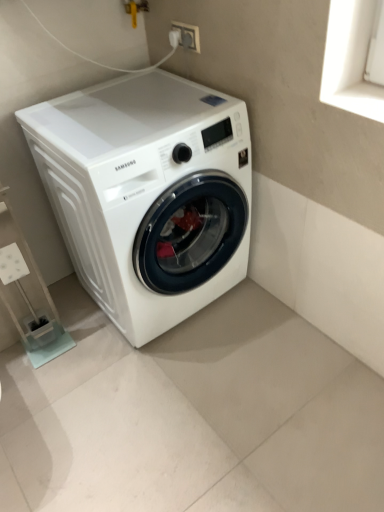
Image resolution: width=384 pixels, height=512 pixels. I want to click on white plastic socket at upper center, so click(x=188, y=34).

You are a GUI agent. You are given a task and a screenshot of the screen. Output one action in this format:
    pyautogui.click(x=<x>, y=<y>)
    Task: Click on the white plastic socket at upper center
    
    Given the screenshot: What is the action you would take?
    pyautogui.click(x=188, y=34)

Is white plastic shelf at lower left turned away from white plastic socket at upper center?

white plastic shelf at lower left does not have its back to white plastic socket at upper center.

Between point (19, 231) and point (195, 32), which one is positioned in front?

The point (195, 32) is in front.

Considering their positions, is white plastic shelf at lower left located in front of or behind white plastic socket at upper center?

In the image, white plastic shelf at lower left appears in front of white plastic socket at upper center.

Considering the relative sizes of white plastic shelf at lower left and white plastic socket at upper center in the image provided, is white plastic shelf at lower left taller than white plastic socket at upper center?

Indeed, white plastic shelf at lower left has a greater height compared to white plastic socket at upper center.

In the scene shown: From the image's perspective, which object appears higher, white plastic socket at upper center or white glossy washing machine at center?

white plastic socket at upper center.

Which point is more distant from viewer, (193,42) or (153,305)?

The point (153,305) is farther from the camera.

From the picture: Considering the positions of objects white plastic socket at upper center and white glossy washing machine at center in the image provided, who is more to the right, white plastic socket at upper center or white glossy washing machine at center?

Positioned to the right is white plastic socket at upper center.

Do you think white plastic socket at upper center is within white glossy washing machine at center, or outside of it?

white plastic socket at upper center lies outside white glossy washing machine at center.

From a real-world perspective, which is physically above, white glossy washing machine at center or white plastic socket at upper center?

white plastic socket at upper center is physically above.

In terms of width, does white glossy washing machine at center look wider or thinner when compared to white plastic socket at upper center?

Clearly, white glossy washing machine at center has more width compared to white plastic socket at upper center.

Considering the points (105, 131) and (181, 41), which point is in front, point (105, 131) or point (181, 41)?

The point (105, 131) is in front.

Considering the positions of objects white glossy washing machine at center and white plastic socket at upper center in the image provided, who is in front, white glossy washing machine at center or white plastic socket at upper center?

white glossy washing machine at center is closer to the camera.

Is white plastic socket at upper center aimed at white plastic shelf at lower left?

No, white plastic socket at upper center is not oriented towards white plastic shelf at lower left.

Is white plastic socket at upper center not inside white plastic shelf at lower left?

white plastic socket at upper center is positioned outside white plastic shelf at lower left.

Are white plastic socket at upper center and white plastic shelf at lower left far apart?

Yes, white plastic socket at upper center is far from white plastic shelf at lower left.

Can you confirm if white plastic socket at upper center is shorter than white plastic shelf at lower left?

Yes.

From the image's perspective, is white plastic shelf at lower left on white glossy washing machine at center?

Actually, white plastic shelf at lower left appears below white glossy washing machine at center in the image.

Considering the points (49, 348) and (199, 123), which point is in front, point (49, 348) or point (199, 123)?

Positioned in front is point (199, 123).

Is white plastic shelf at lower left completely or partially outside of white glossy washing machine at center?

That's correct, white plastic shelf at lower left is outside of white glossy washing machine at center.

Is white plastic shelf at lower left looking in the opposite direction of white glossy washing machine at center?

No.

Image resolution: width=384 pixels, height=512 pixels. Identify the location of washing machine that appears above the white plastic shelf at lower left (from the image's perspective). (144, 191).

How far apart are white glossy washing machine at center and white plastic shelf at lower left?

white glossy washing machine at center is 17.73 inches from white plastic shelf at lower left.

Is white glossy washing machine at center positioned far away from white plastic shelf at lower left?

white glossy washing machine at center is near white plastic shelf at lower left, not far away.

In the image, there is a white plastic shelf at lower left. At what (x,y) coordinates should I click in order to perform the action: click on electric outlet above it (from the image's perspective). Please return your answer as a coordinate pair (x, y). The image size is (384, 512). Looking at the image, I should click on (188, 34).

Find the location of `washing machine on the left of the white plastic socket at upper center`. washing machine on the left of the white plastic socket at upper center is located at coordinates (144, 191).

Considering their positions, is white plastic shelf at lower left positioned further to white plastic socket at upper center than white glossy washing machine at center?

white plastic shelf at lower left is positioned further to the anchor white plastic socket at upper center.

From the image, which object appears to be nearer to white glossy washing machine at center, white plastic shelf at lower left or white plastic socket at upper center?

Based on the image, white plastic shelf at lower left appears to be nearer to white glossy washing machine at center.

Estimate the real-world distances between objects in this image. Which object is further from white glossy washing machine at center, white plastic socket at upper center or white plastic shelf at lower left?

white plastic socket at upper center is further to white glossy washing machine at center.

Considering their positions, is white glossy washing machine at center positioned closer to white plastic socket at upper center than white plastic shelf at lower left?

Among the two, white glossy washing machine at center is located nearer to white plastic socket at upper center.

Which object lies further to the anchor point white plastic shelf at lower left, white plastic socket at upper center or white glossy washing machine at center?

white plastic socket at upper center is positioned further to the anchor white plastic shelf at lower left.

Looking at the image, which one is located further to white plastic shelf at lower left, white glossy washing machine at center or white plastic socket at upper center?

Based on the image, white plastic socket at upper center appears to be further to white plastic shelf at lower left.

Locate an element on the screen. Image resolution: width=384 pixels, height=512 pixels. washing machine between white plastic socket at upper center and white plastic shelf at lower left in the up-down direction is located at coordinates (144, 191).